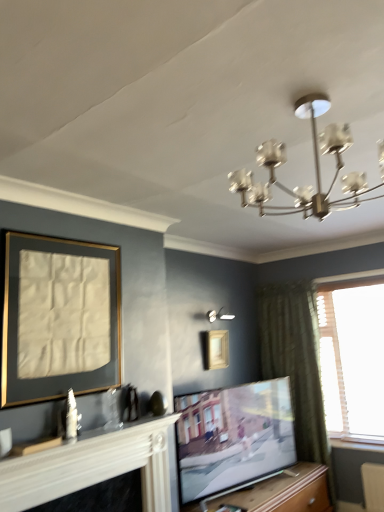
Locate an element on the screen. empty space that is ontop of matte gold picture frame at left, positioned as the second picture frame in back-to-front order is located at coordinates [x=62, y=238].